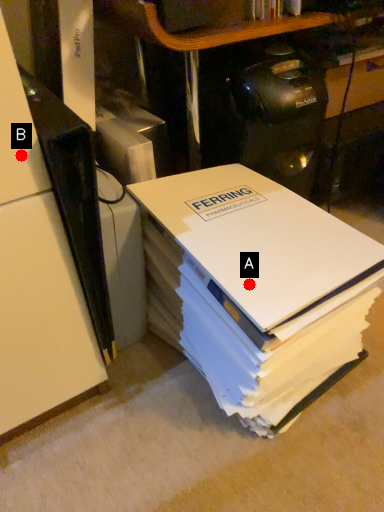
Question: Two points are circled on the image, labeled by A and B beside each circle. Among these points, which one is farthest from the camera?

Choices:
 (A) A is further
 (B) B is further

Answer: (A)